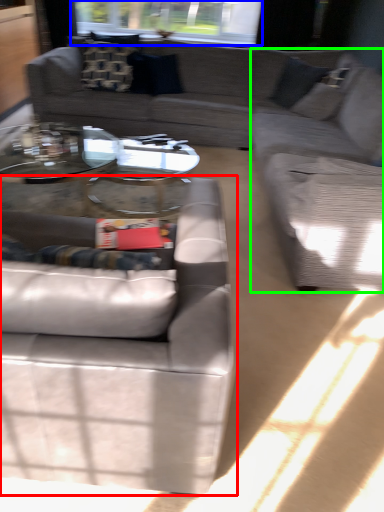
Question: Based on their relative distances, which object is farther from studio couch (highlighted by a red box)? Choose from window screen (highlighted by a blue box) and couch (highlighted by a green box).

Choices:
 (A) window screen
 (B) couch

Answer: (A)